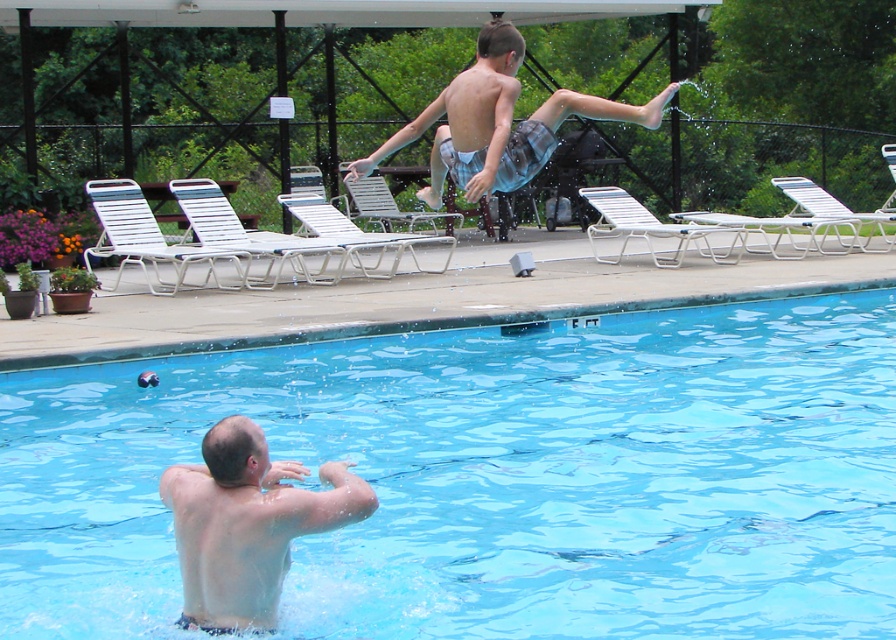
You are a lifeguard standing at the edge of the pool. You see the transparent blue water at center and the light blue plaid shorts at upper center. Can you safely reach both objects with a 4 meter long pole?

The transparent blue water at center and light blue plaid shorts at upper center are 3.99 meters apart. Since the pole is 4 meters long, you can safely reach both objects as the distance between them is within the pole length.

You are standing at the edge of the pool and see two points marked in the image. Which point is closer to you, point (x=229, y=476) or point (x=444, y=154)?

Point (x=229, y=476) is in front of point (x=444, y=154), so it is closer to you.